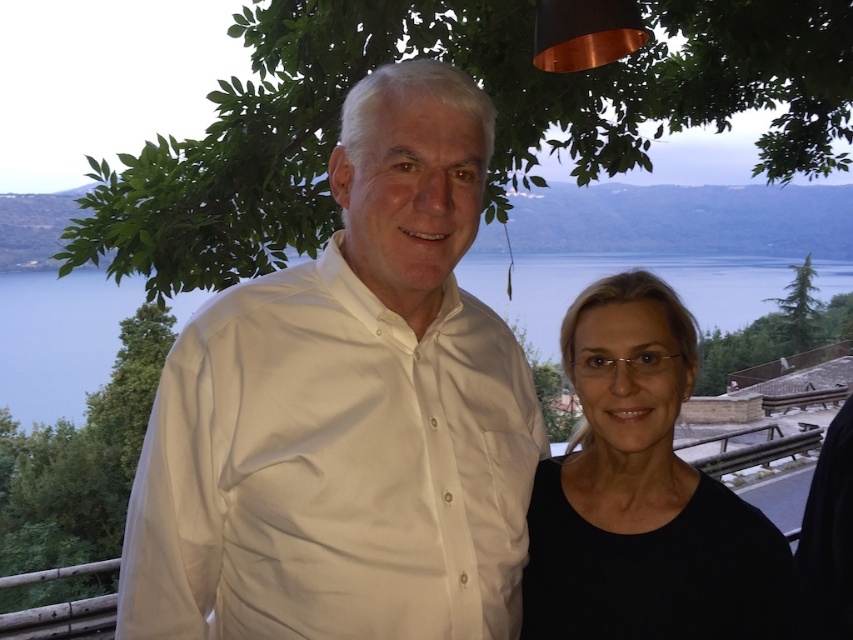
Who is more distant from viewer, (807, 77) or (181, 320)?

Point (181, 320)

Which is behind, point (494, 148) or point (715, 275)?

The point (715, 275) is more distant.

Find the location of a particular element. green leafy tree at upper center is located at coordinates (486, 92).

Based on the photo, does white smooth shirt at center have a greater height compared to green leafy tree at left?

Correct, white smooth shirt at center is much taller as green leafy tree at left.

This screenshot has height=640, width=853. Identify the location of white smooth shirt at center. (347, 412).

Who is shorter, green leafy tree at upper center or green leafy tree at left?

green leafy tree at left is shorter.

Does green leafy tree at upper center appear on the right side of green leafy tree at left?

Indeed, green leafy tree at upper center is positioned on the right side of green leafy tree at left.

Is point (352, 4) positioned behind point (61, 426)?

No, (352, 4) is closer to viewer.

Find the location of a particular element. green leafy tree at upper center is located at coordinates (486, 92).